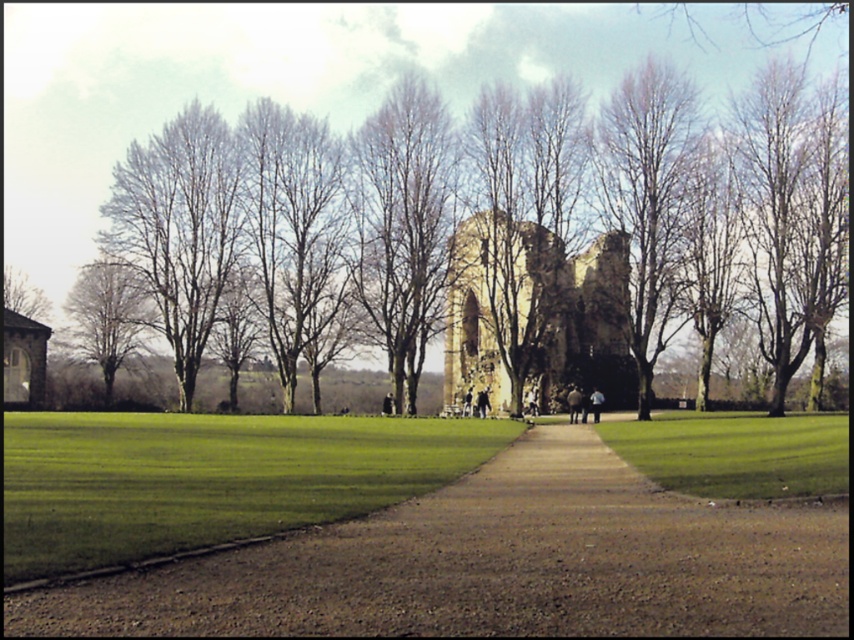
Describe the element at coordinates (648, 202) in the screenshot. This screenshot has height=640, width=854. I see `brown textured tree at center` at that location.

Which is in front, point (646, 348) or point (91, 262)?

Point (646, 348)

Is point (633, 252) farther from viewer compared to point (121, 291)?

That is False.

The width and height of the screenshot is (854, 640). What are the coordinates of `brown textured tree at center` in the screenshot? It's located at (648, 202).

Does brown textured tree at center appear under brown leafless tree at left?

Actually, brown textured tree at center is above brown leafless tree at left.

Which is more to the right, brown textured tree at center or brown leafless tree at left?

Positioned to the right is brown textured tree at center.

Where is `brown textured tree at center`? brown textured tree at center is located at coordinates (648, 202).

The width and height of the screenshot is (854, 640). In order to click on brown textured tree at center in this screenshot , I will do `click(648, 202)`.

Between green grass at lower left and green grass at lower right, which one appears on the left side from the viewer's perspective?

green grass at lower left

Between point (252, 524) and point (670, 458), which one is positioned behind?

The point (670, 458) is behind.

Locate an element on the screen. The width and height of the screenshot is (854, 640). green grass at lower left is located at coordinates (209, 477).